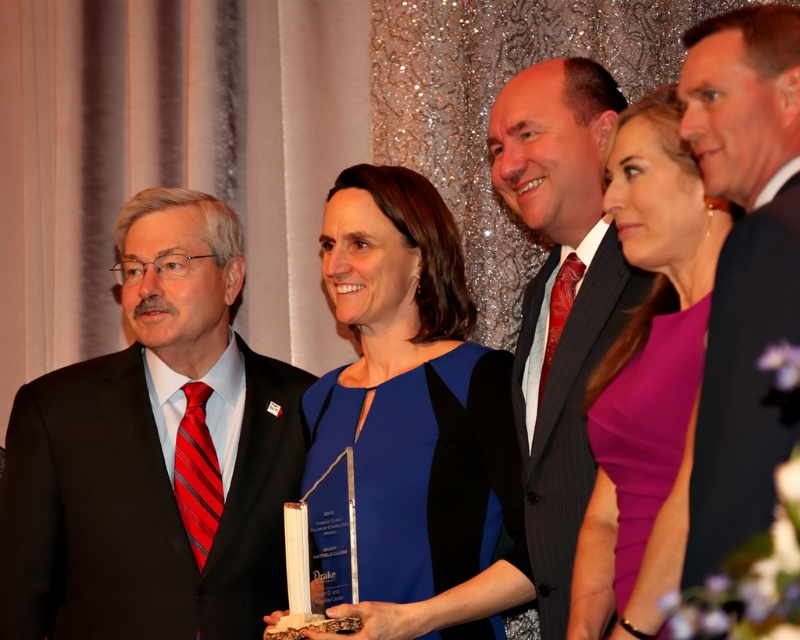
You are a photographer at the event and need to adjust the lighting between the matte black suit at left and the purple satin dress at center. The minimum distance required for your equipment is 1 meter. Can you use your current setup between these two objects?

The distance between the matte black suit at left and purple satin dress at center is 98.21 centimeters, which is less than 1 meter. Therefore, your current setup cannot be used between these two objects as it requires at least 1 meter of space.

You are a photographer at a formal event. You need to take a photo of the shiny black suit at center and the black suit at right. Which one will appear larger in the photo?

The black suit at right will appear larger in the photo because it is closer to the viewer than the shiny black suit at center.